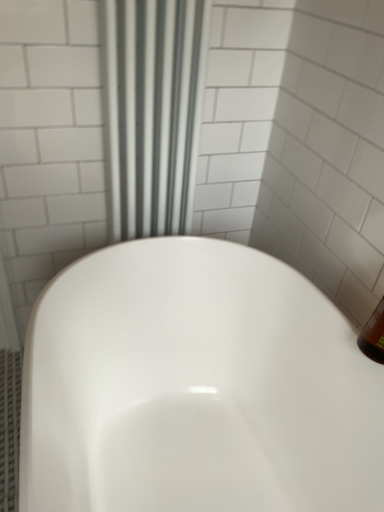
Identify the location of white glossy bathtub at center. This screenshot has height=512, width=384. (196, 387).

What do you see at coordinates (196, 387) in the screenshot? The height and width of the screenshot is (512, 384). I see `white glossy bathtub at center` at bounding box center [196, 387].

Identify the location of white fabric shower curtain at upper center. The width and height of the screenshot is (384, 512). (153, 112).

Measure the distance between white fabric shower curtain at upper center and camera.

The distance of white fabric shower curtain at upper center from camera is 37.26 inches.

The height and width of the screenshot is (512, 384). What do you see at coordinates (153, 112) in the screenshot? I see `white fabric shower curtain at upper center` at bounding box center [153, 112].

Identify the location of white glossy bathtub at center. The image size is (384, 512). (196, 387).

From the picture: Between white glossy bathtub at center and white fabric shower curtain at upper center, which one appears on the left side from the viewer's perspective?

white fabric shower curtain at upper center is more to the left.

Is white glossy bathtub at center further to camera compared to white fabric shower curtain at upper center?

No, white glossy bathtub at center is closer to the viewer.

Is point (186, 374) farther from viewer compared to point (119, 20)?

Yes.

From the image's perspective, between white glossy bathtub at center and white fabric shower curtain at upper center, which one is located above?

white fabric shower curtain at upper center.

From a real-world perspective, between white glossy bathtub at center and white fabric shower curtain at upper center, who is vertically higher?

Answer: In real-world perspective, white fabric shower curtain at upper center is above.

Which object is thinner, white glossy bathtub at center or white fabric shower curtain at upper center?

white fabric shower curtain at upper center is thinner.

Can you confirm if white glossy bathtub at center is shorter than white fabric shower curtain at upper center?

Yes, white glossy bathtub at center is shorter than white fabric shower curtain at upper center.

Considering the sizes of white glossy bathtub at center and white fabric shower curtain at upper center in the image, is white glossy bathtub at center bigger or smaller than white fabric shower curtain at upper center?

Considering their sizes, white glossy bathtub at center takes up more space than white fabric shower curtain at upper center.

Would you say white glossy bathtub at center is inside or outside white fabric shower curtain at upper center?

white glossy bathtub at center is not inside white fabric shower curtain at upper center, it's outside.

Is white glossy bathtub at center with white fabric shower curtain at upper center?

No, white glossy bathtub at center is not in contact with white fabric shower curtain at upper center.

Could you tell me if white glossy bathtub at center is turned towards white fabric shower curtain at upper center?

No, white glossy bathtub at center does not turn towards white fabric shower curtain at upper center.

Based on the photo, how different are the orientations of white glossy bathtub at center and white fabric shower curtain at upper center in degrees?

The angular difference between white glossy bathtub at center and white fabric shower curtain at upper center is 90 degrees.

Locate an element on the screen. The width and height of the screenshot is (384, 512). shower curtain above the white glossy bathtub at center (from the image's perspective) is located at coordinates (153, 112).

Considering the positions of objects white fabric shower curtain at upper center and white glossy bathtub at center in the image provided, who is more to the left, white fabric shower curtain at upper center or white glossy bathtub at center?

white fabric shower curtain at upper center is more to the left.

Is white fabric shower curtain at upper center behind white glossy bathtub at center?

That is True.

Does point (118, 220) appear closer or farther from the camera than point (162, 422)?

Point (118, 220) is closer to the camera than point (162, 422).

From the image's perspective, is white fabric shower curtain at upper center located above or below white glossy bathtub at center?

Based on their image positions, white fabric shower curtain at upper center is located above white glossy bathtub at center.

From a real-world perspective, who is located lower, white fabric shower curtain at upper center or white glossy bathtub at center?

From a 3D spatial view, white glossy bathtub at center is below.

Is white fabric shower curtain at upper center wider or thinner than white glossy bathtub at center?

Clearly, white fabric shower curtain at upper center has less width compared to white glossy bathtub at center.

Considering the sizes of objects white fabric shower curtain at upper center and white glossy bathtub at center in the image provided, who is taller, white fabric shower curtain at upper center or white glossy bathtub at center?

Standing taller between the two is white fabric shower curtain at upper center.

Considering the sizes of white fabric shower curtain at upper center and white glossy bathtub at center in the image, is white fabric shower curtain at upper center bigger or smaller than white glossy bathtub at center?

Clearly, white fabric shower curtain at upper center is smaller in size than white glossy bathtub at center.

Is white glossy bathtub at center completely or partially inside white fabric shower curtain at upper center?

Definitely not — white glossy bathtub at center is not inside white fabric shower curtain at upper center.

Are white fabric shower curtain at upper center and white glossy bathtub at center making contact?

There is a gap between white fabric shower curtain at upper center and white glossy bathtub at center.

Is white fabric shower curtain at upper center oriented towards white glossy bathtub at center?

Yes, white fabric shower curtain at upper center faces towards white glossy bathtub at center.

What's the angular difference between white fabric shower curtain at upper center and white glossy bathtub at center's facing directions?

They differ by 90 degrees in their facing directions.

How distant is white fabric shower curtain at upper center from white glossy bathtub at center?

They are 16.25 inches apart.

Where is `bathtub beneath the white fabric shower curtain at upper center (from a real-world perspective)`? This screenshot has width=384, height=512. bathtub beneath the white fabric shower curtain at upper center (from a real-world perspective) is located at coordinates (196, 387).

Identify the location of shower curtain that appears above the white glossy bathtub at center (from a real-world perspective). (153, 112).

You are a GUI agent. You are given a task and a screenshot of the screen. Output one action in this format:
    pyautogui.click(x=<x>, y=<y>)
    Task: Click on the shower curtain located behind the white glossy bathtub at center
    The width and height of the screenshot is (384, 512).
    Given the screenshot: What is the action you would take?
    pyautogui.click(x=153, y=112)